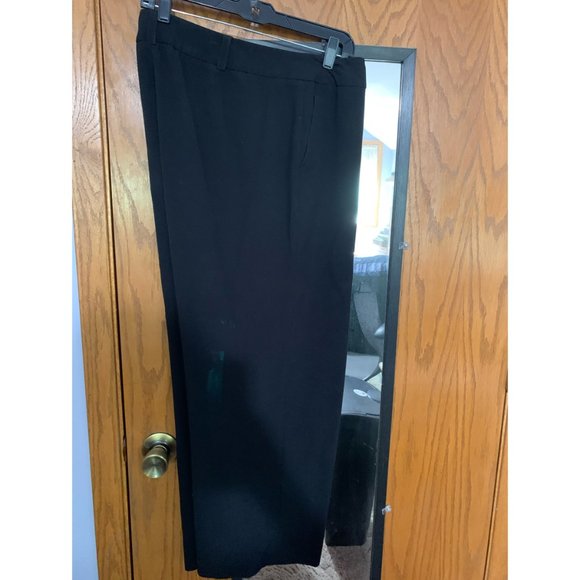
This screenshot has height=580, width=580. Identify the location of wood door. (452, 143).